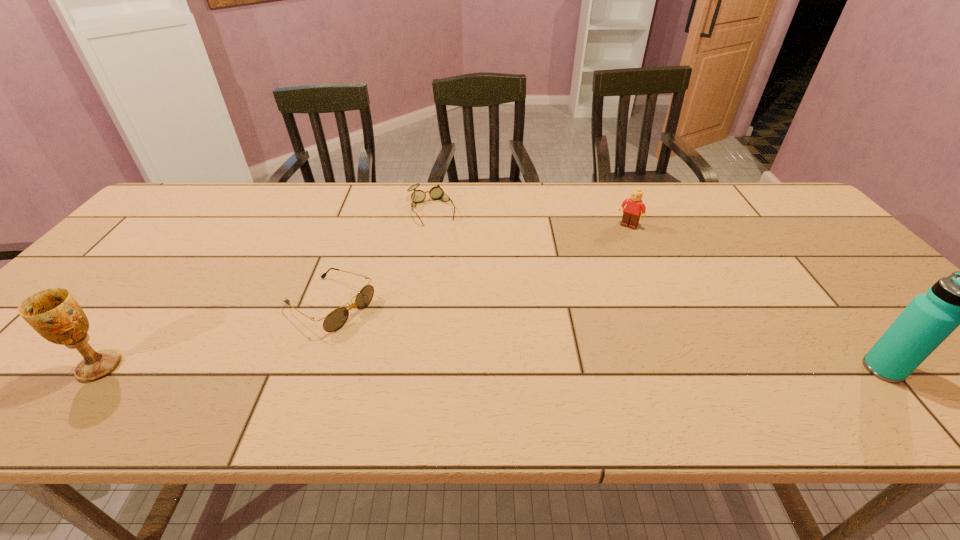
You are a GUI agent. You are given a task and a screenshot of the screen. Output one action in this format:
    pyautogui.click(x=<x>, y=<y>)
    Task: Click on the leftmost object
    
    Given the screenshot: What is the action you would take?
    pyautogui.click(x=53, y=313)

The image size is (960, 540). I want to click on the second tallest object, so click(53, 313).

Where is `water bottle`? The width and height of the screenshot is (960, 540). water bottle is located at coordinates (959, 299).

In order to click on the tallest object in this screenshot , I will do 959,299.

The height and width of the screenshot is (540, 960). I want to click on sunglasses, so click(x=336, y=319).

Find the location of `the fourth object from right to left`. the fourth object from right to left is located at coordinates (336, 319).

The image size is (960, 540). In order to click on Lego in this screenshot , I will do `click(634, 206)`.

In order to click on the second object from right to left in this screenshot , I will do `click(634, 206)`.

The image size is (960, 540). What are the coordinates of `the third object from right to left` in the screenshot? It's located at (418, 196).

At what (x,y) coordinates should I click in order to perform the action: click on spectacles. Please return your answer as a coordinate pair (x, y). Looking at the image, I should click on (x=418, y=196).